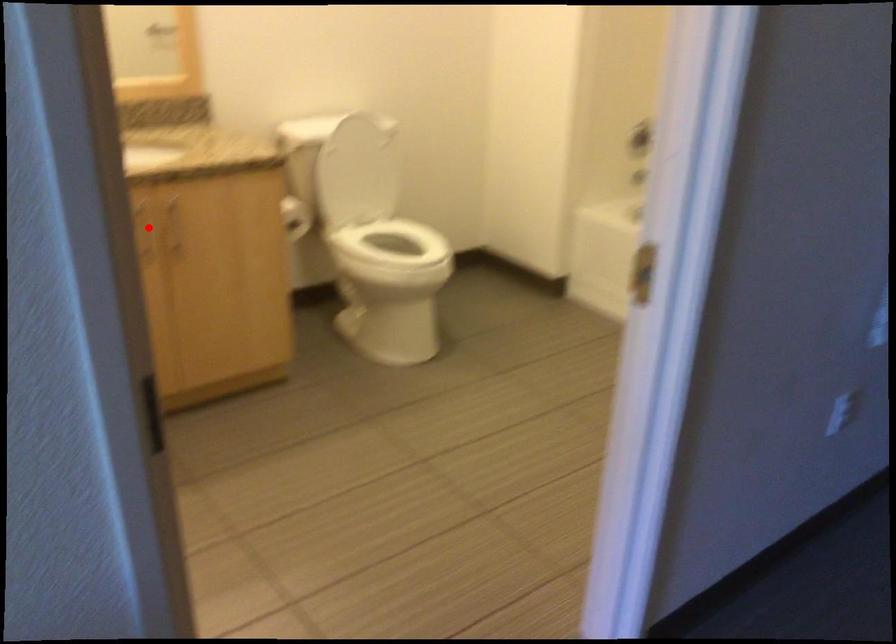
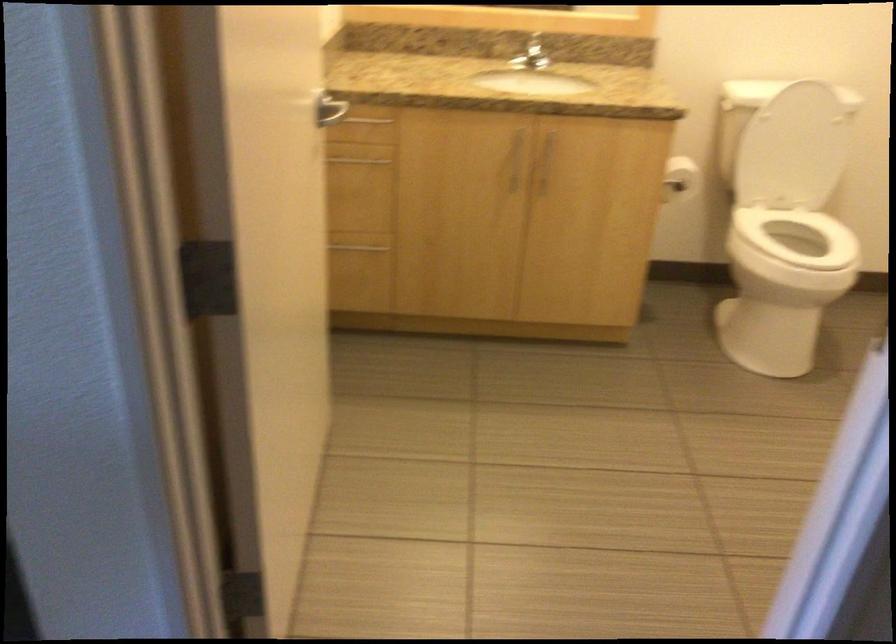
Question: I am providing you with two images of the same scene from different viewpoints. A red point is marked on the first image. At the location where the point appears in image 1, is it still visible in image 2?

Choices:
 (A) Yes
 (B) No

Answer: (A)